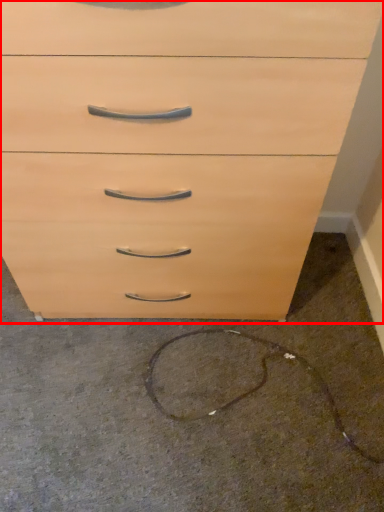
Question: From the image's perspective, what is the correct spatial relationship of chest of drawers (annotated by the red box) in relation to concrete?

Choices:
 (A) above
 (B) below

Answer: (A)